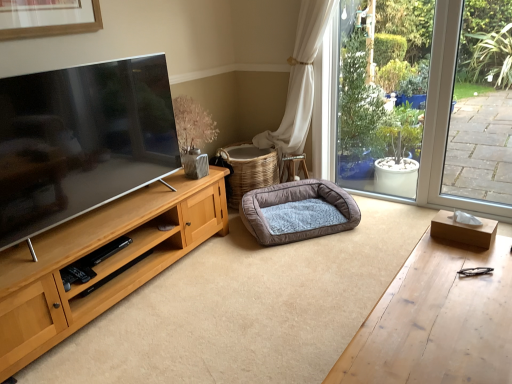
Locate an element on the screen. This screenshot has height=384, width=512. vacant point above wooden desk at lower right (from a real-world perspective) is located at coordinates (450, 312).